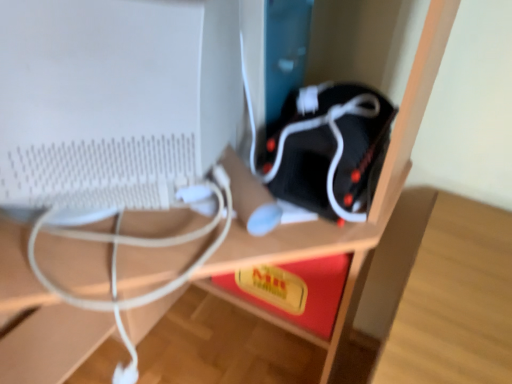
Measure the distance between white matte computer monitor at left and camera.

white matte computer monitor at left is 16.81 inches from camera.

Identify the location of white matte computer monitor at left. The image size is (512, 384). (114, 98).

In order to face white matte computer monitor at left, should I rotate leftwards or rightwards?

Turn left approximately 25.215 degrees to face it.

This screenshot has width=512, height=384. What do you see at coordinates (114, 98) in the screenshot?
I see `white matte computer monitor at left` at bounding box center [114, 98].

What is the approximate width of white matte computer monitor at left?

It is 17.83 inches.

Locate an element on the screen. The width and height of the screenshot is (512, 384). black matte speaker at center is located at coordinates (329, 149).

What is the approximate height of black matte speaker at center?

The height of black matte speaker at center is 17.76 centimeters.

The image size is (512, 384). What do you see at coordinates (329, 149) in the screenshot?
I see `black matte speaker at center` at bounding box center [329, 149].

Locate an element on the screen. Image resolution: width=512 pixels, height=384 pixels. white matte computer monitor at left is located at coordinates (114, 98).

Considering the positions of objects black matte speaker at center and white matte computer monitor at left in the image provided, who is more to the right, black matte speaker at center or white matte computer monitor at left?

From the viewer's perspective, black matte speaker at center appears more on the right side.

Is the depth of black matte speaker at center greater than that of white matte computer monitor at left?

Yes, it is.

Between point (277, 169) and point (137, 40), which one is positioned in front?

The point (137, 40) is closer to the camera.

From the image's perspective, which one is positioned lower, black matte speaker at center or white matte computer monitor at left?

black matte speaker at center, from the image's perspective.

From a real-world perspective, is black matte speaker at center positioned under white matte computer monitor at left based on gravity?

Yes, from a real-world perspective, black matte speaker at center is under white matte computer monitor at left.

Considering the relative sizes of black matte speaker at center and white matte computer monitor at left in the image provided, is black matte speaker at center thinner than white matte computer monitor at left?

Correct, the width of black matte speaker at center is less than that of white matte computer monitor at left.

Who is taller, black matte speaker at center or white matte computer monitor at left?

white matte computer monitor at left.

Who is smaller, black matte speaker at center or white matte computer monitor at left?

black matte speaker at center.

Is black matte speaker at center inside or outside of white matte computer monitor at left?

black matte speaker at center is outside white matte computer monitor at left.

Is black matte speaker at center not near white matte computer monitor at left?

No, there isn't a large distance between black matte speaker at center and white matte computer monitor at left.

Could you tell me if black matte speaker at center is facing white matte computer monitor at left?

No.

How different are the orientations of black matte speaker at center and white matte computer monitor at left in degrees?

They differ by 75.9 degrees in their facing directions.

How much distance is there between black matte speaker at center and white matte computer monitor at left?

A distance of 10.19 inches exists between black matte speaker at center and white matte computer monitor at left.

Find the location of a particular element. equipment on the right of white matte computer monitor at left is located at coordinates (329, 149).

Is white matte computer monitor at left to the left of black matte speaker at center from the viewer's perspective?

Yes.

In the scene shown: Who is more distant, white matte computer monitor at left or black matte speaker at center?

Positioned behind is black matte speaker at center.

Does point (117, 72) appear closer or farther from the camera than point (301, 161)?

Point (117, 72) is closer to the camera than point (301, 161).

From the image's perspective, relative to black matte speaker at center, is white matte computer monitor at left above or below?

white matte computer monitor at left is situated higher than black matte speaker at center in the image.

From a real-world perspective, is white matte computer monitor at left positioned over black matte speaker at center based on gravity?

Yes, from a real-world perspective, white matte computer monitor at left is above black matte speaker at center.

Is white matte computer monitor at left wider than black matte speaker at center?

Yes.

Does white matte computer monitor at left have a greater height compared to black matte speaker at center?

Correct, white matte computer monitor at left is much taller as black matte speaker at center.

Considering the sizes of white matte computer monitor at left and black matte speaker at center in the image, is white matte computer monitor at left bigger or smaller than black matte speaker at center?

In the image, white matte computer monitor at left appears to be larger than black matte speaker at center.

In the scene shown: Which is correct: white matte computer monitor at left is inside black matte speaker at center, or outside of it?

white matte computer monitor at left is not inside black matte speaker at center, it's outside.

Is white matte computer monitor at left beside black matte speaker at center?

No.

Is white matte computer monitor at left turned away from black matte speaker at center?

Absolutely, white matte computer monitor at left is directed away from black matte speaker at center.

How distant is white matte computer monitor at left from black matte speaker at center?

white matte computer monitor at left and black matte speaker at center are 10.19 inches apart.

This screenshot has height=384, width=512. I want to click on equipment located behind the white matte computer monitor at left, so click(x=329, y=149).

Find the location of `computer monitor to the left of black matte speaker at center`. computer monitor to the left of black matte speaker at center is located at coordinates (114, 98).

The image size is (512, 384). In order to click on computer monitor in front of the black matte speaker at center in this screenshot , I will do `click(114, 98)`.